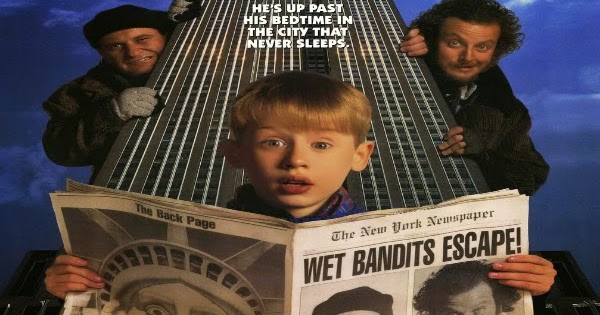
This screenshot has width=600, height=315. I want to click on news paper, so click(x=296, y=263).